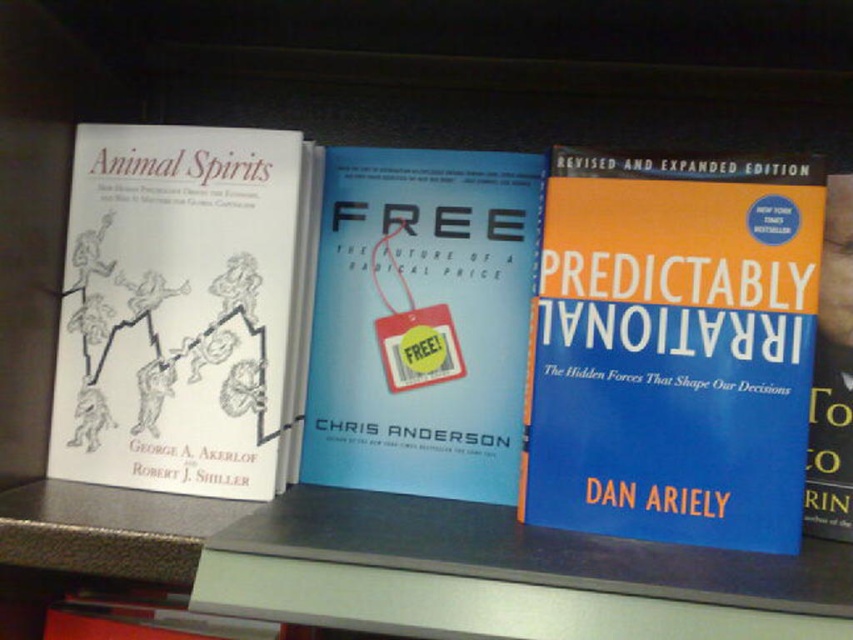
Question: Does blue hardcover book at center appear on the right side of blue matte book at center?

Choices:
 (A) yes
 (B) no

Answer: (A)

Question: Which point is closer to the camera taking this photo?

Choices:
 (A) (91, 416)
 (B) (721, 196)
 (C) (440, 465)

Answer: (B)

Question: From the image, what is the correct spatial relationship of white paper at left in relation to blue matte book at center?

Choices:
 (A) left
 (B) right

Answer: (A)

Question: From the image, what is the correct spatial relationship of blue hardcover book at center in relation to blue matte book at center?

Choices:
 (A) above
 (B) below

Answer: (B)

Question: Among these objects, which one is farthest from the camera?

Choices:
 (A) blue matte book at center
 (B) white paper at left
 (C) blue hardcover book at center

Answer: (A)

Question: Among these objects, which one is farthest from the camera?

Choices:
 (A) blue matte book at center
 (B) blue hardcover book at center
 (C) white paper at left

Answer: (A)